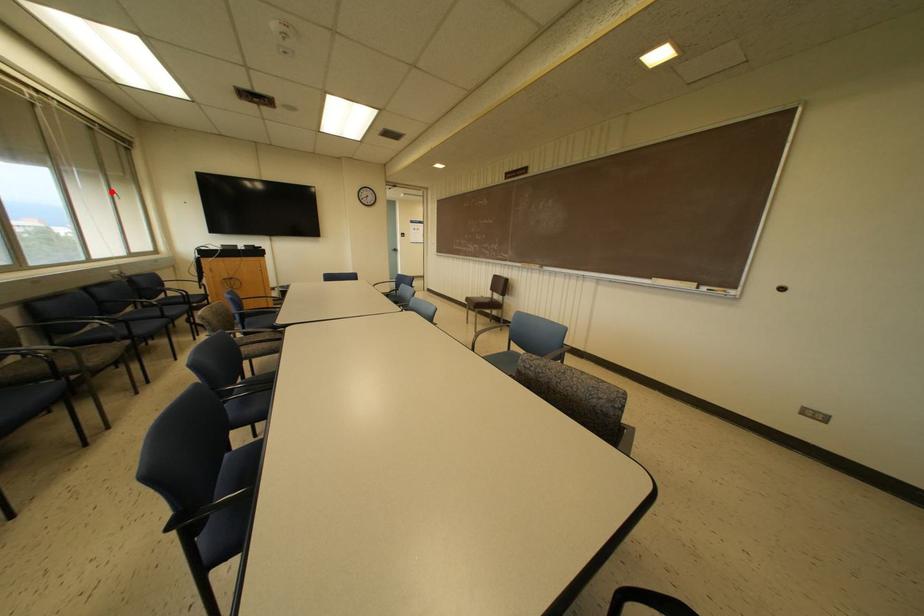
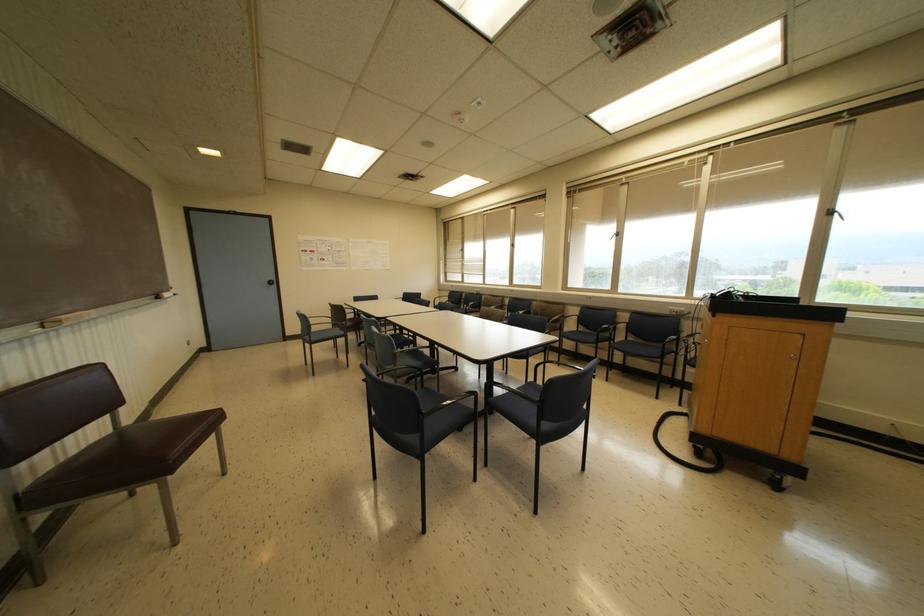
The point at the highlighted location is marked in the first image. Where is the corresponding point in the second image?

(827, 213)